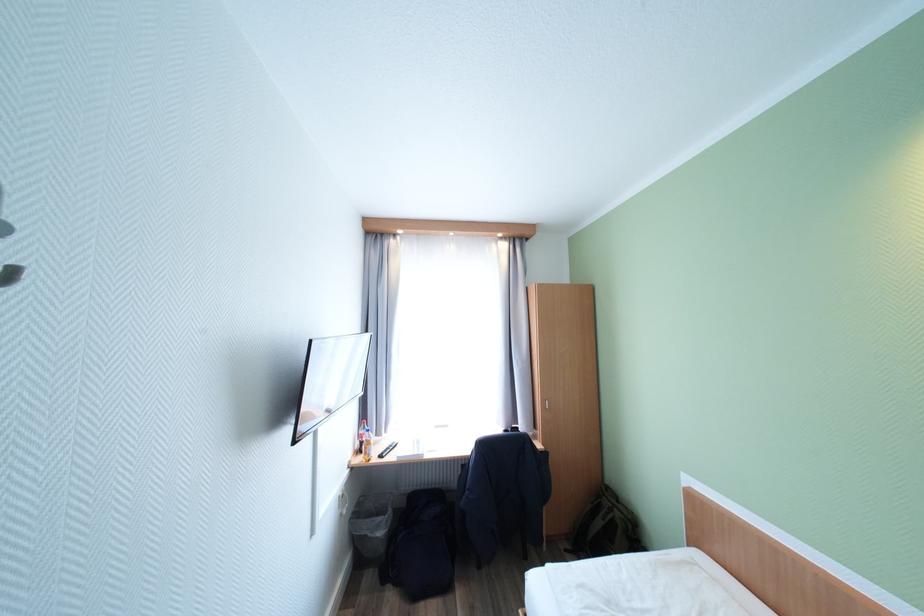
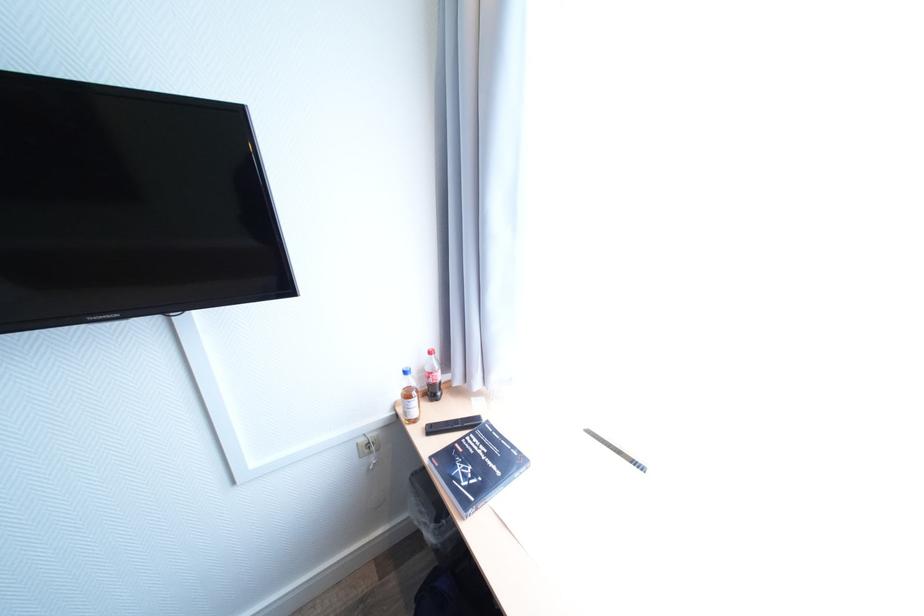
In the second image, find the point that corresponds to (x=357, y=463) in the first image.

(403, 403)